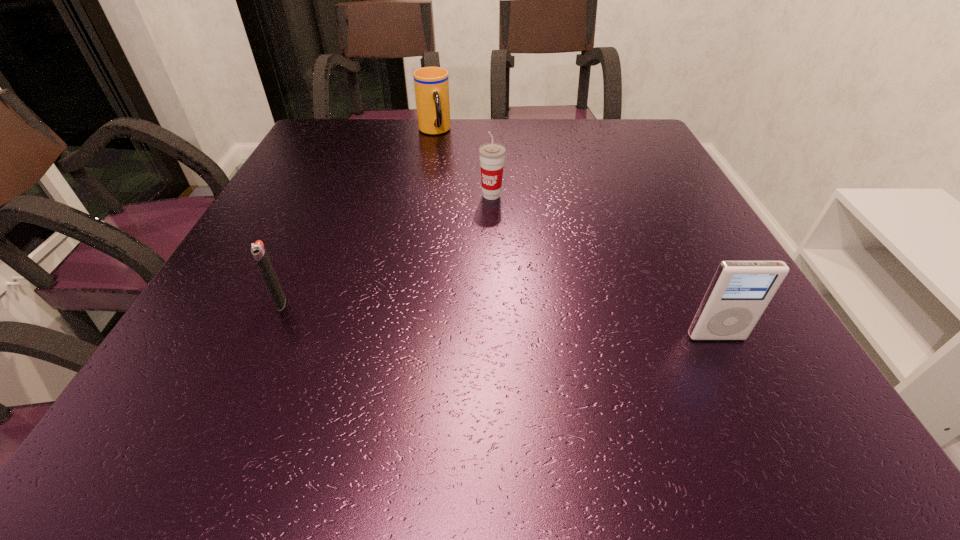
Where is `vacant area situated on the side of the second object from left to right with the handle`? The width and height of the screenshot is (960, 540). vacant area situated on the side of the second object from left to right with the handle is located at coordinates (458, 183).

Where is `vacant space located 0.340m on the side of the second object from left to right with the handle`? The width and height of the screenshot is (960, 540). vacant space located 0.340m on the side of the second object from left to right with the handle is located at coordinates (470, 207).

Where is `free region located 0.270m on the side of the nearer cup with the logo`? The image size is (960, 540). free region located 0.270m on the side of the nearer cup with the logo is located at coordinates (474, 283).

Find the location of a particular element. This screenshot has width=960, height=540. free location located on the side of the nearer cup with the logo is located at coordinates coord(482,242).

Where is `free location located 0.080m on the side of the nearer cup with the logo`? This screenshot has height=540, width=960. free location located 0.080m on the side of the nearer cup with the logo is located at coordinates (486, 222).

Where is `object at the far edge`? object at the far edge is located at coordinates (431, 84).

Image resolution: width=960 pixels, height=540 pixels. In order to click on object at the near edge in this screenshot , I will do `click(740, 291)`.

Locate an element on the screen. The width and height of the screenshot is (960, 540). object that is positioned at the left edge is located at coordinates (258, 250).

In order to click on object present at the right edge in this screenshot , I will do `click(740, 291)`.

You are a GUI agent. You are given a task and a screenshot of the screen. Output one action in this format:
    pyautogui.click(x=<x>, y=<y>)
    Task: Click on the object at the near right corner
    Image resolution: width=960 pixels, height=540 pixels.
    Given the screenshot: What is the action you would take?
    740,291